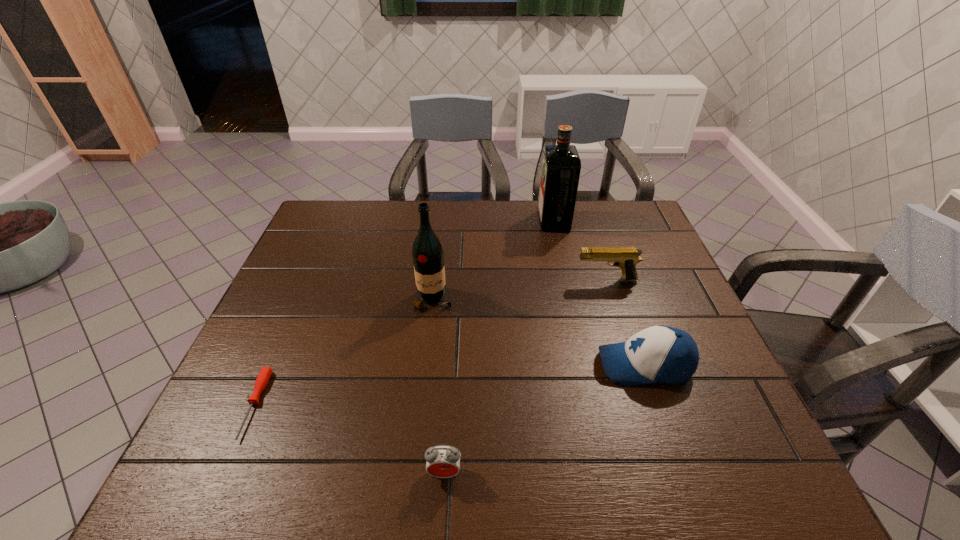
The image size is (960, 540). In order to click on object that is the third nearest to the nearest object in this screenshot , I will do `click(428, 257)`.

Image resolution: width=960 pixels, height=540 pixels. Find the location of `the fourth closest object relative to the pistol`. the fourth closest object relative to the pistol is located at coordinates (443, 461).

The height and width of the screenshot is (540, 960). What are the coordinates of `free space in the image that satisfies the following two spatial constraints: 1. at the barrel of the pistol; 2. at the tip of the leftmost object` in the screenshot? It's located at (646, 404).